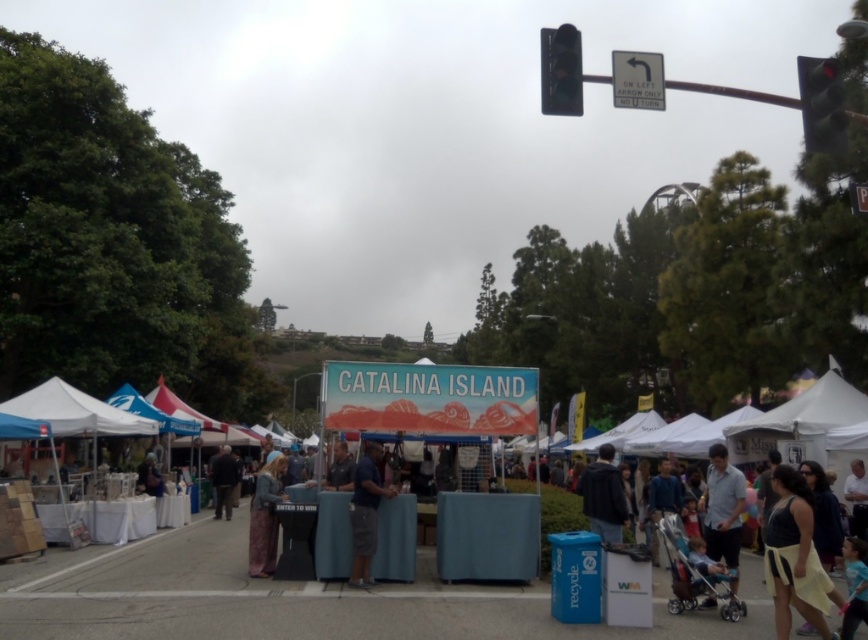
Is red glass traffic light at upper right positioned at the back of dark gray jacket at center?

No, it is not.

Does red glass traffic light at upper right have a lesser width compared to dark gray jacket at center?

No, red glass traffic light at upper right is not thinner than dark gray jacket at center.

Between point (840, 86) and point (594, 468), which one is positioned in front?

Point (840, 86)

Image resolution: width=868 pixels, height=640 pixels. Identify the location of red glass traffic light at upper right. (x=822, y=104).

Does yellow fabric dress at lower right lie in front of dark brown leather jacket at center?

Yes, it is.

Between yellow fabric dress at lower right and dark brown leather jacket at center, which one appears on the right side from the viewer's perspective?

From the viewer's perspective, yellow fabric dress at lower right appears more on the right side.

Is point (819, 586) farther from viewer compared to point (235, 464)?

No, it is not.

Identify the location of yellow fabric dress at lower right. The width and height of the screenshot is (868, 640). (794, 557).

Does blue fabric booth at center lie behind yellow fabric dress at lower right?

Yes.

Who is more distant from viewer, (x=324, y=627) or (x=794, y=604)?

Positioned behind is point (x=324, y=627).

Where is `blue fabric booth at center`? This screenshot has height=640, width=868. blue fabric booth at center is located at coordinates tap(301, 598).